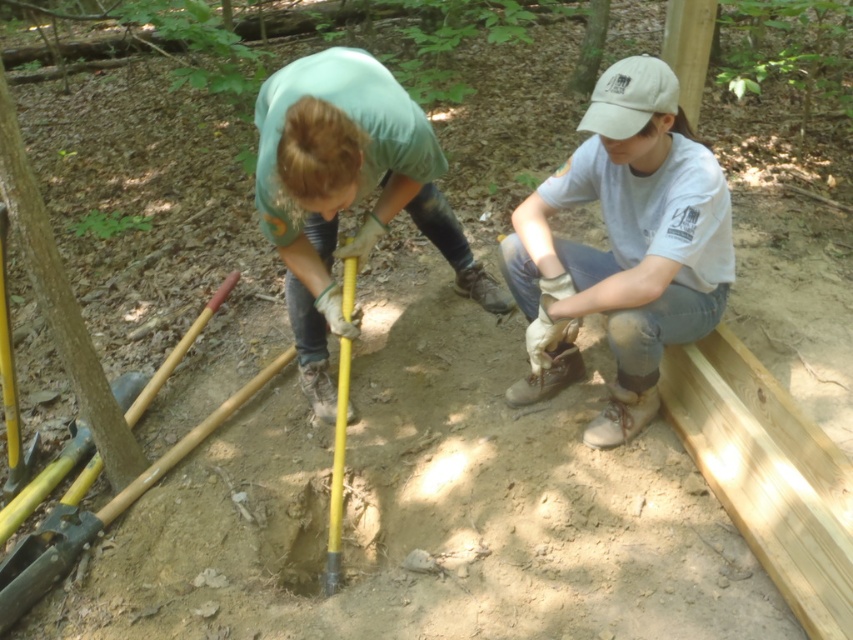
What is the exact coordinate of the green fabric shirt at center?

The green fabric shirt at center is located at coordinate point (347, 192).

You are a safety inspector checking the equipment in the image. The white cotton cap at upper center and the yellow plastic shovel at center are both present. Which object has a greater width?

The white cotton cap at upper center has a larger width than the yellow plastic shovel at center.

Based on the scene description, which object is positioned higher in the image? The white cotton cap at upper center or the yellow plastic shovel at center?

The white cotton cap at upper center is positioned higher than the yellow plastic shovel at center.